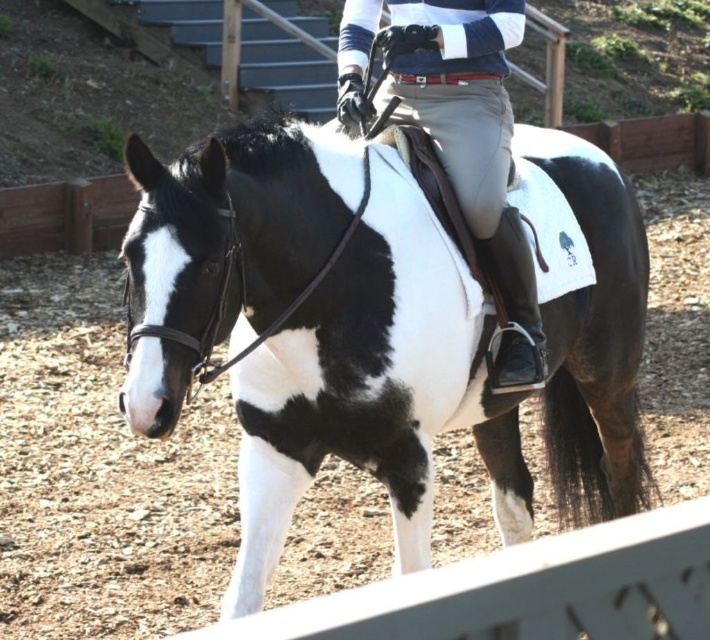
Question: Which object appears farthest from the camera in this image?

Choices:
 (A) light gray pants at center
 (B) black and white speckled horse at center

Answer: (A)

Question: Can you confirm if black and white speckled horse at center is thinner than light gray pants at center?

Choices:
 (A) no
 (B) yes

Answer: (A)

Question: Which point is farther to the camera?

Choices:
 (A) black and white speckled horse at center
 (B) light gray pants at center

Answer: (B)

Question: Does black and white speckled horse at center have a smaller size compared to light gray pants at center?

Choices:
 (A) no
 (B) yes

Answer: (A)

Question: Is the position of black and white speckled horse at center less distant than that of light gray pants at center?

Choices:
 (A) no
 (B) yes

Answer: (B)

Question: Which point appears farthest from the camera in this image?

Choices:
 (A) (344, 19)
 (B) (390, 362)

Answer: (A)